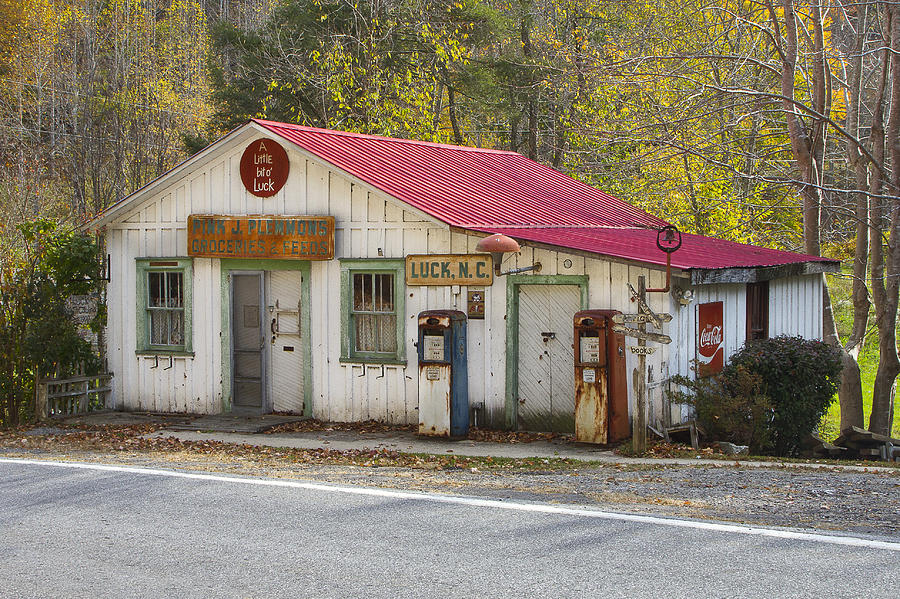
Where is `door`? This screenshot has height=599, width=900. door is located at coordinates (249, 320), (277, 316), (559, 308).